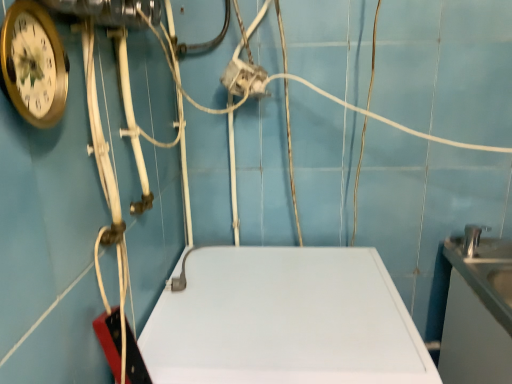
Image resolution: width=512 pixels, height=384 pixels. Describe the element at coordinates (483, 264) in the screenshot. I see `satin silver sink at right` at that location.

This screenshot has width=512, height=384. Identify the location of white matte counter top at center, the second counter top positioned from the right. (284, 320).

Find the location of a particular element. The height and width of the screenshot is (384, 512). white glossy counter top at right, which appears as the second counter top when viewed from the left is located at coordinates (478, 314).

From a real-world perspective, between white glossy counter top at right, the 1th counter top viewed from the right, and satin silver sink at right, who is vertically higher?

In real-world perspective, satin silver sink at right is above.

Is white glossy counter top at right, which appears as the second counter top when viewed from the left, facing away from satin silver sink at right?

No, white glossy counter top at right, which appears as the second counter top when viewed from the left,'s orientation is not away from satin silver sink at right.

Is white glossy counter top at right, the 1th counter top viewed from the right, in front of or behind satin silver sink at right in the image?

Clearly, white glossy counter top at right, the 1th counter top viewed from the right, is in front of satin silver sink at right.

Between satin silver sink at right and white matte counter top at center, the second counter top positioned from the right, which one has less height?

satin silver sink at right.

Can you see satin silver sink at right touching white matte counter top at center, positioned as the first counter top in left-to-right order?

No.

Does satin silver sink at right appear on the right side of white matte counter top at center, positioned as the first counter top in left-to-right order?

Indeed, satin silver sink at right is positioned on the right side of white matte counter top at center, positioned as the first counter top in left-to-right order.

From a real-world perspective, is satin silver sink at right positioned over white matte counter top at center, the second counter top positioned from the right, based on gravity?

Yes, from a real-world perspective, satin silver sink at right is on top of white matte counter top at center, the second counter top positioned from the right.

Can you confirm if satin silver sink at right is bigger than white glossy counter top at right, the 1th counter top viewed from the right?

Incorrect, satin silver sink at right is not larger than white glossy counter top at right, the 1th counter top viewed from the right.

Is satin silver sink at right placed right next to white glossy counter top at right, the 1th counter top viewed from the right?

Yes, the surface of satin silver sink at right is in contact with white glossy counter top at right, the 1th counter top viewed from the right.

Considering the sizes of objects white matte counter top at center, positioned as the first counter top in left-to-right order, and white glossy counter top at right, which appears as the second counter top when viewed from the left, in the image provided, who is smaller, white matte counter top at center, positioned as the first counter top in left-to-right order, or white glossy counter top at right, which appears as the second counter top when viewed from the left,?

With smaller size is white glossy counter top at right, which appears as the second counter top when viewed from the left.

In order to click on counter top that is above the white matte counter top at center, positioned as the first counter top in left-to-right order (from a real-world perspective) in this screenshot , I will do `click(478, 314)`.

Does white matte counter top at center, the second counter top positioned from the right, turn towards white glossy counter top at right, which appears as the second counter top when viewed from the left?

No.

Which is correct: white matte counter top at center, positioned as the first counter top in left-to-right order, is inside white glossy counter top at right, the 1th counter top viewed from the right, or outside of it?

white matte counter top at center, positioned as the first counter top in left-to-right order, is not inside white glossy counter top at right, the 1th counter top viewed from the right, it's outside.

This screenshot has height=384, width=512. Identify the location of counter top that is in front of the white glossy counter top at right, the 1th counter top viewed from the right. (284, 320).

From their relative heights in the image, would you say white glossy counter top at right, which appears as the second counter top when viewed from the left, is taller or shorter than white matte counter top at center, positioned as the first counter top in left-to-right order?

Clearly, white glossy counter top at right, which appears as the second counter top when viewed from the left, is shorter compared to white matte counter top at center, positioned as the first counter top in left-to-right order.

Based on the photo, does white glossy counter top at right, the 1th counter top viewed from the right, have a larger size compared to white matte counter top at center, the second counter top positioned from the right?

Actually, white glossy counter top at right, the 1th counter top viewed from the right, might be smaller than white matte counter top at center, the second counter top positioned from the right.

Between white matte counter top at center, the second counter top positioned from the right, and satin silver sink at right, which one has more height?

white matte counter top at center, the second counter top positioned from the right, is taller.

Is white matte counter top at center, the second counter top positioned from the right, behind satin silver sink at right?

No, white matte counter top at center, the second counter top positioned from the right, is closer to the viewer.

Does white matte counter top at center, positioned as the first counter top in left-to-right order, have a lesser width compared to satin silver sink at right?

In fact, white matte counter top at center, positioned as the first counter top in left-to-right order, might be wider than satin silver sink at right.

Identify the location of sink on the right of white matte counter top at center, positioned as the first counter top in left-to-right order. (483, 264).

What are the coordinates of `counter top that is the 1st one when counting downward from the satin silver sink at right (from the image's perspective)` in the screenshot? It's located at (478, 314).

I want to click on sink above the white matte counter top at center, positioned as the first counter top in left-to-right order (from the image's perspective), so click(x=483, y=264).

From the image, which object appears to be farther from white matte counter top at center, the second counter top positioned from the right, satin silver sink at right or white glossy counter top at right, the 1th counter top viewed from the right?

satin silver sink at right lies further to white matte counter top at center, the second counter top positioned from the right, than the other object.

Estimate the real-world distances between objects in this image. Which object is further from white glossy counter top at right, which appears as the second counter top when viewed from the left, white matte counter top at center, positioned as the first counter top in left-to-right order, or satin silver sink at right?

Based on the image, white matte counter top at center, positioned as the first counter top in left-to-right order, appears to be further to white glossy counter top at right, which appears as the second counter top when viewed from the left.

When comparing their distances from white glossy counter top at right, which appears as the second counter top when viewed from the left, does satin silver sink at right or white matte counter top at center, the second counter top positioned from the right, seem closer?

Among the two, satin silver sink at right is located nearer to white glossy counter top at right, which appears as the second counter top when viewed from the left.

Looking at the image, which one is located further to white matte counter top at center, the second counter top positioned from the right, white glossy counter top at right, the 1th counter top viewed from the right, or satin silver sink at right?

Among the two, satin silver sink at right is located further to white matte counter top at center, the second counter top positioned from the right.

Looking at this image, looking at the image, which one is located closer to satin silver sink at right, white matte counter top at center, the second counter top positioned from the right, or white glossy counter top at right, the 1th counter top viewed from the right?

white glossy counter top at right, the 1th counter top viewed from the right, is closer to satin silver sink at right.

Looking at the image, which one is located closer to satin silver sink at right, white glossy counter top at right, the 1th counter top viewed from the right, or white matte counter top at center, positioned as the first counter top in left-to-right order?

Result: Based on the image, white glossy counter top at right, the 1th counter top viewed from the right, appears to be nearer to satin silver sink at right.

Identify the location of counter top between white matte counter top at center, the second counter top positioned from the right, and satin silver sink at right from left to right. The width and height of the screenshot is (512, 384). (478, 314).